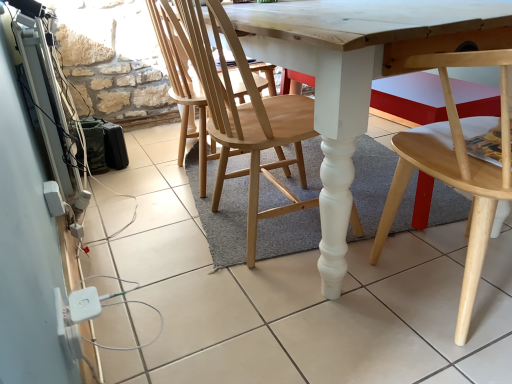
Where is `vacant area that is in front of natural wood chair at center, the 2th chair when ordered from right to left`? The height and width of the screenshot is (384, 512). vacant area that is in front of natural wood chair at center, the 2th chair when ordered from right to left is located at coordinates (268, 307).